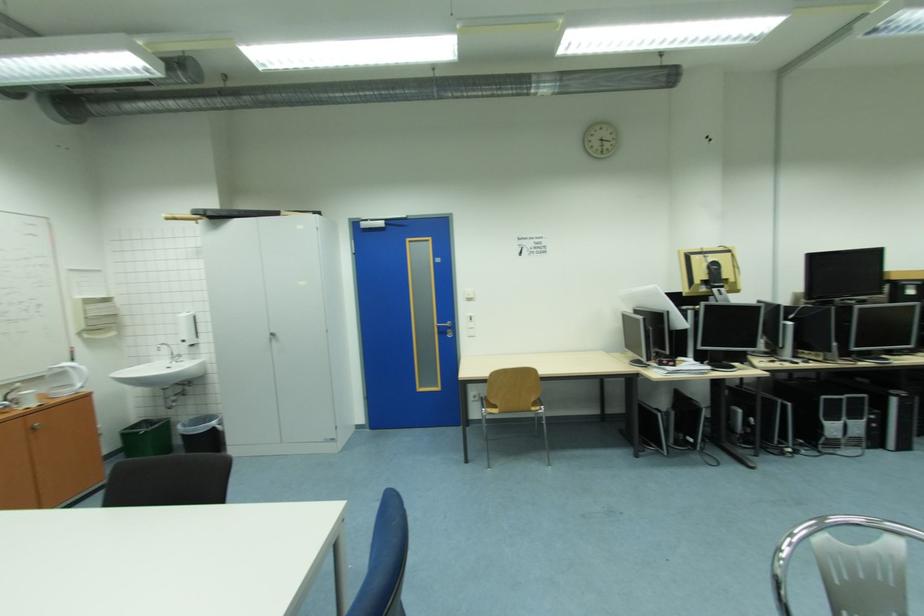
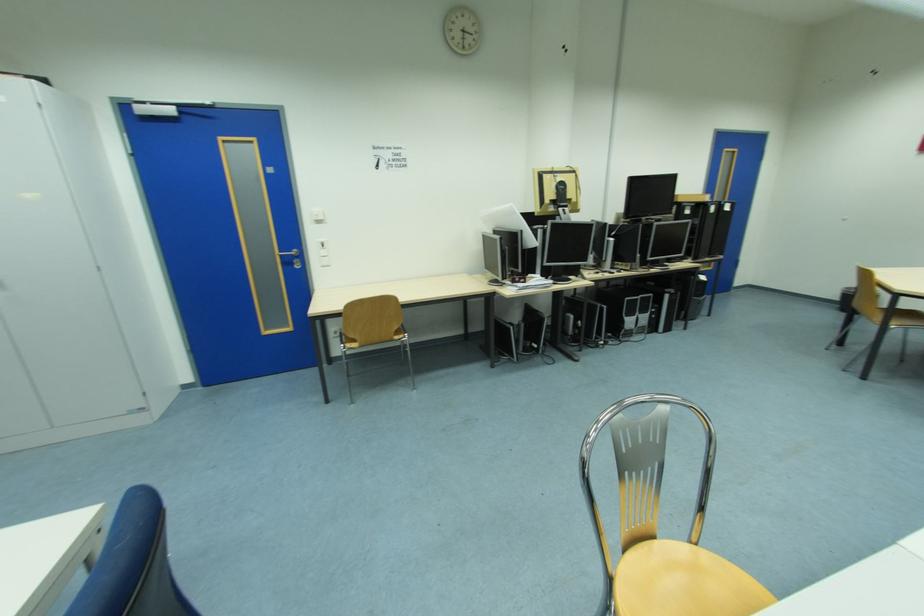
Which direction would the cameraman need to move to produce the second image?

The movement direction of the cameraman is right, forward.